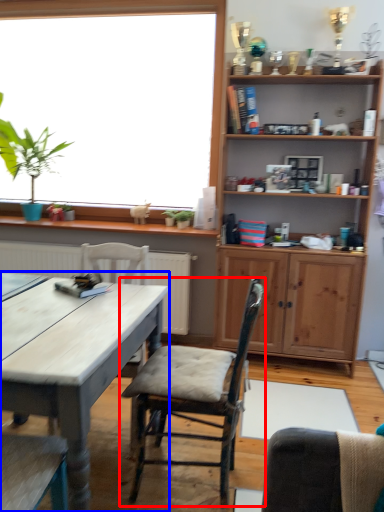
Question: Which object appears farthest to the camera in this image, chair (highlighted by a red box) or desk (highlighted by a blue box)?

Choices:
 (A) chair
 (B) desk

Answer: (A)